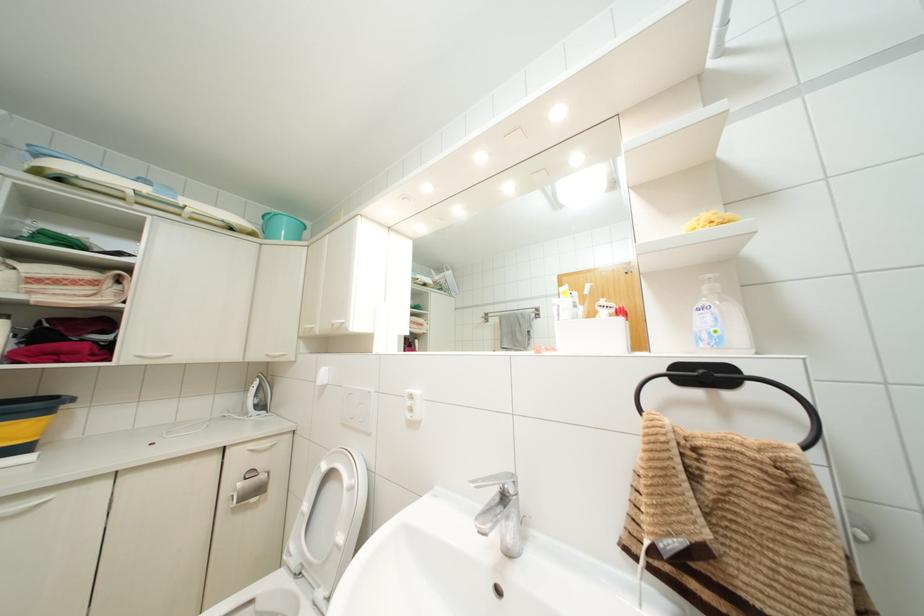
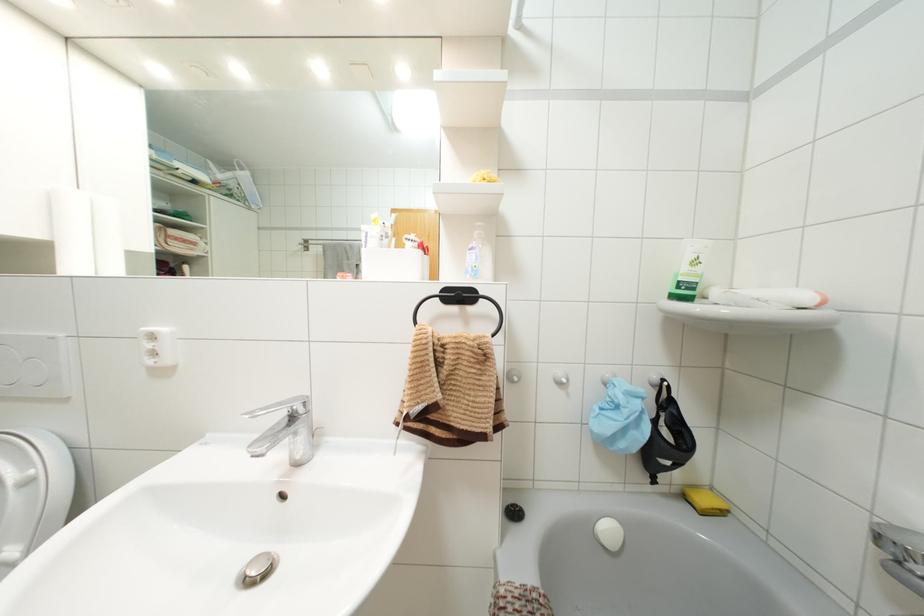
In the second image, find the point that corresponds to [710,275] in the first image.

(479, 223)